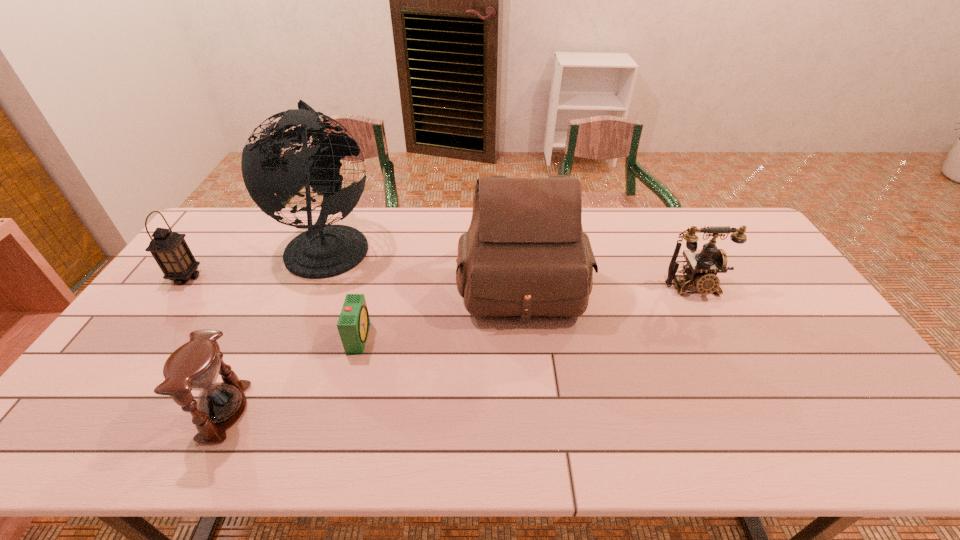
Image resolution: width=960 pixels, height=540 pixels. What are the coordinates of `free space at the far right corner` in the screenshot? It's located at (729, 215).

Where is `free area in between the second tallest object and the lantern`? This screenshot has width=960, height=540. free area in between the second tallest object and the lantern is located at coordinates (354, 281).

What are the coordinates of `empty space between the leftmost object and the rightmost object` in the screenshot? It's located at (440, 282).

At what (x,y) coordinates should I click in order to perform the action: click on free space between the alarm clock and the nearest object. Please return your answer as a coordinate pair (x, y). This screenshot has height=540, width=960. Looking at the image, I should click on (292, 374).

Where is `free space between the lantern and the shortest object`? This screenshot has width=960, height=540. free space between the lantern and the shortest object is located at coordinates (273, 307).

Locate an element on the screen. vacant area between the tallest object and the shortest object is located at coordinates (345, 291).

Where is `empty space between the nearest object and the alarm clock`? The width and height of the screenshot is (960, 540). empty space between the nearest object and the alarm clock is located at coordinates (292, 374).

Select which object appears as the fourth closest to the second tallest object. Please provide its 2D coordinates. Your answer should be formatted as a tuple, i.e. [(x, y)], where the tuple contains the x and y coordinates of a point satisfying the conditions above.

[(194, 366)]

Where is `the fifth closest object relative to the tallest object`? the fifth closest object relative to the tallest object is located at coordinates 702,266.

Image resolution: width=960 pixels, height=540 pixels. I want to click on free space that satisfies the following two spatial constraints: 1. on the front flap of the satchel; 2. on the front-facing side of the shortest object, so click(x=527, y=337).